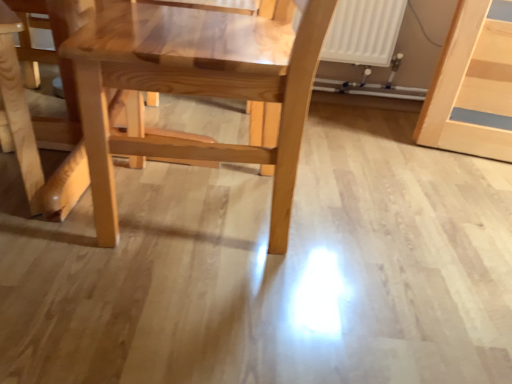
Locate an element on the screen. This screenshot has height=384, width=512. vacant space in front of natural wood chair at center is located at coordinates (193, 311).